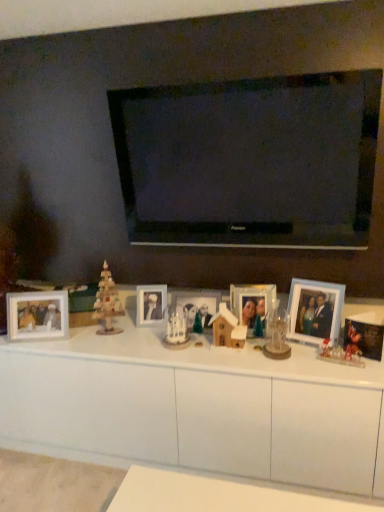
The width and height of the screenshot is (384, 512). Find the location of `free region on the left part of translucent plastic gingerbread house at lower right, which appears as the first toy when viewed from the front`. free region on the left part of translucent plastic gingerbread house at lower right, which appears as the first toy when viewed from the front is located at coordinates (303, 364).